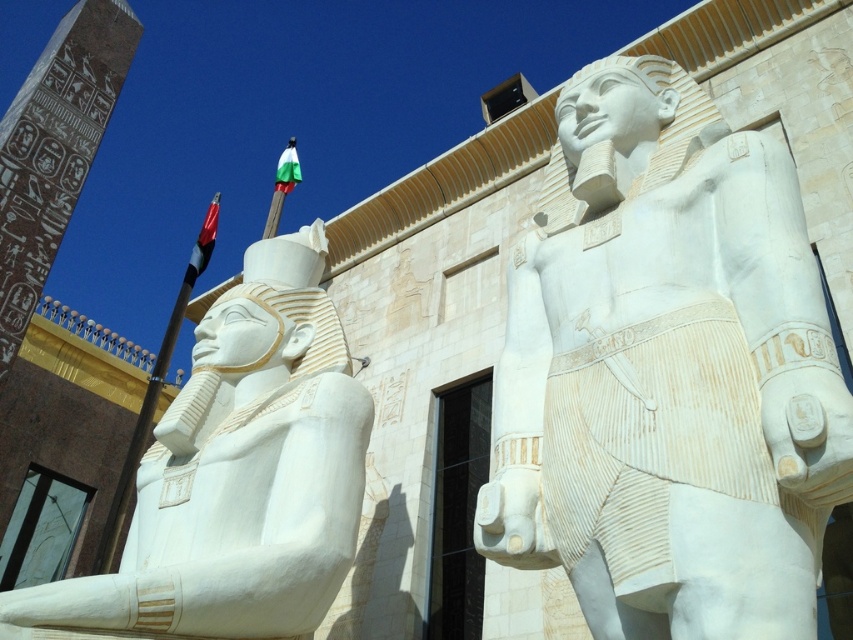
Which of these two, white marble statue at center or white marble statue at left, stands shorter?

Standing shorter between the two is white marble statue at left.

Does white marble statue at center have a greater width compared to white marble statue at left?

No.

Is point (751, 340) closer to viewer compared to point (154, 476)?

Yes, point (751, 340) is closer to viewer.

Image resolution: width=853 pixels, height=640 pixels. Find the location of `white marble statue at center`. white marble statue at center is located at coordinates (666, 372).